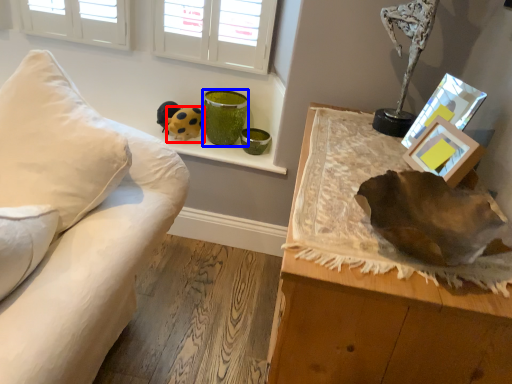
Question: Among these objects, which one is nearest to the camera, toy (highlighted by a red box) or vase (highlighted by a blue box)?

Choices:
 (A) toy
 (B) vase

Answer: (B)